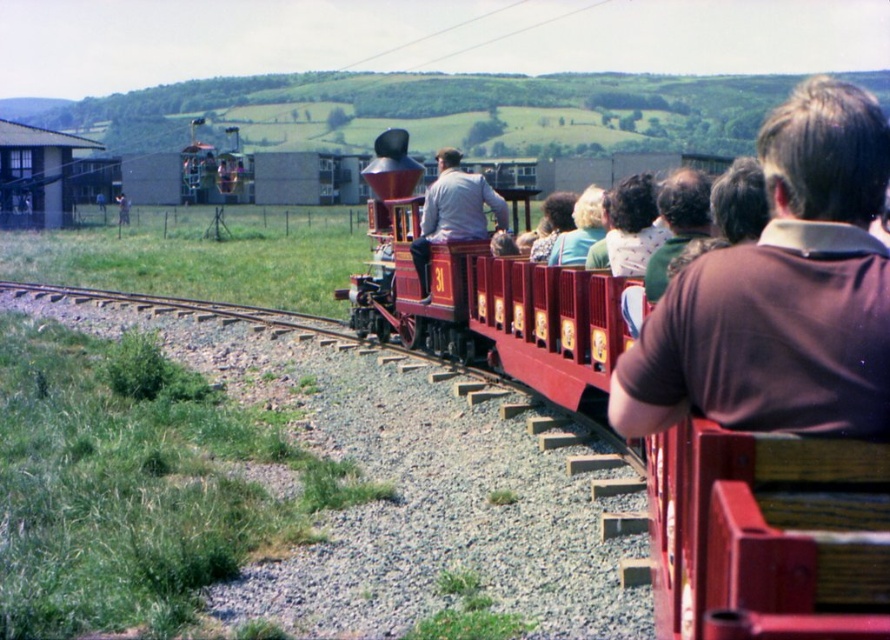
Question: Estimate the real-world distances between objects in this image. Which object is farther from the light gray fabric jacket at center?

Choices:
 (A) wooden bench at center
 (B) brown shirt at upper right

Answer: (B)

Question: Estimate the real-world distances between objects in this image. Which object is farther from the brown shirt at upper right?

Choices:
 (A) blonde hair at center
 (B) light gray fabric jacket at center
 (C) wooden bench at center

Answer: (A)

Question: Among these points, which one is nearest to the camera?

Choices:
 (A) (823, 104)
 (B) (575, 208)
 (C) (804, 598)
 (D) (425, 275)

Answer: (C)

Question: Does wooden bench at center have a lesser width compared to light gray fabric jacket at center?

Choices:
 (A) no
 (B) yes

Answer: (A)

Question: Does light gray fabric jacket at center appear over blonde hair at center?

Choices:
 (A) yes
 (B) no

Answer: (B)

Question: Is wooden bench at center closer to camera compared to brown shirt at upper right?

Choices:
 (A) yes
 (B) no

Answer: (A)